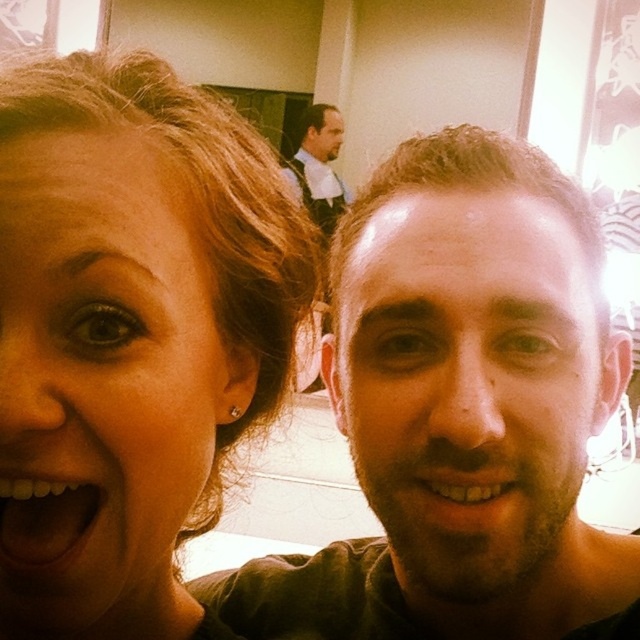
Which is more to the right, matte gold earring at upper left or matte black face at upper center?

Positioned to the right is matte black face at upper center.

Does point (56, 124) come behind point (307, 147)?

No, it is not.

Between point (118, 600) and point (326, 118), which one is positioned in front?

Positioned in front is point (118, 600).

At what (x,y) coordinates should I click in order to perform the action: click on matte gold earring at upper left. Please return your answer as a coordinate pair (x, y). The height and width of the screenshot is (640, 640). Looking at the image, I should click on (131, 336).

Does brown matte face at center appear on the left side of matte skin at center?

Yes, brown matte face at center is to the left of matte skin at center.

Is point (564, 515) more distant than point (429, 492)?

Yes, point (564, 515) is farther from viewer.

Does point (358, 480) come in front of point (461, 508)?

No, it is behind (461, 508).

The image size is (640, 640). I want to click on brown matte face at center, so click(467, 381).

Can you confirm if brown matte hair at center is smaller than matte skin at center?

No.

Which is more to the left, brown matte hair at center or matte skin at center?

From the viewer's perspective, brown matte hair at center appears more on the left side.

Is point (480, 220) more distant than point (468, 516)?

Yes, it is behind point (468, 516).

Image resolution: width=640 pixels, height=640 pixels. Find the location of `brown matte hair at center`. brown matte hair at center is located at coordinates (458, 406).